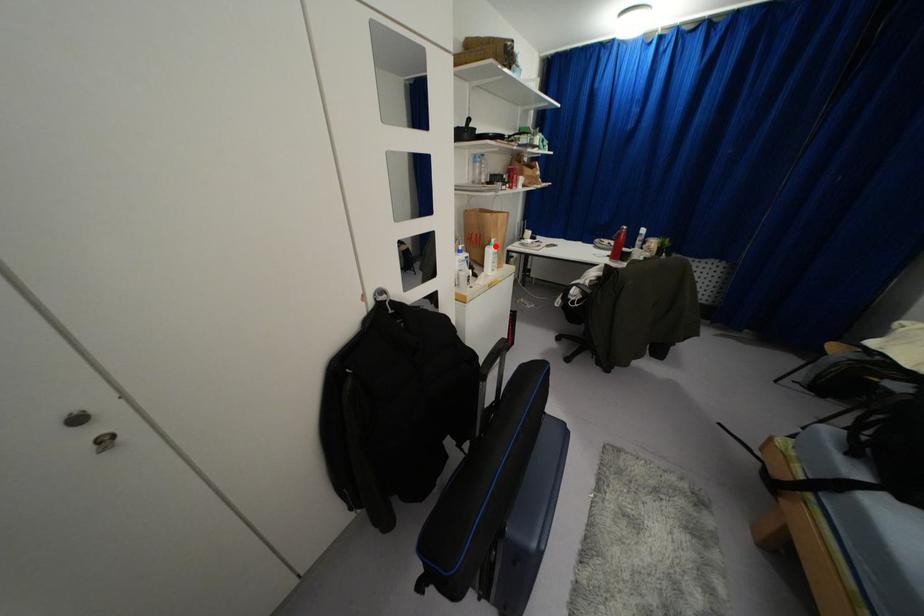
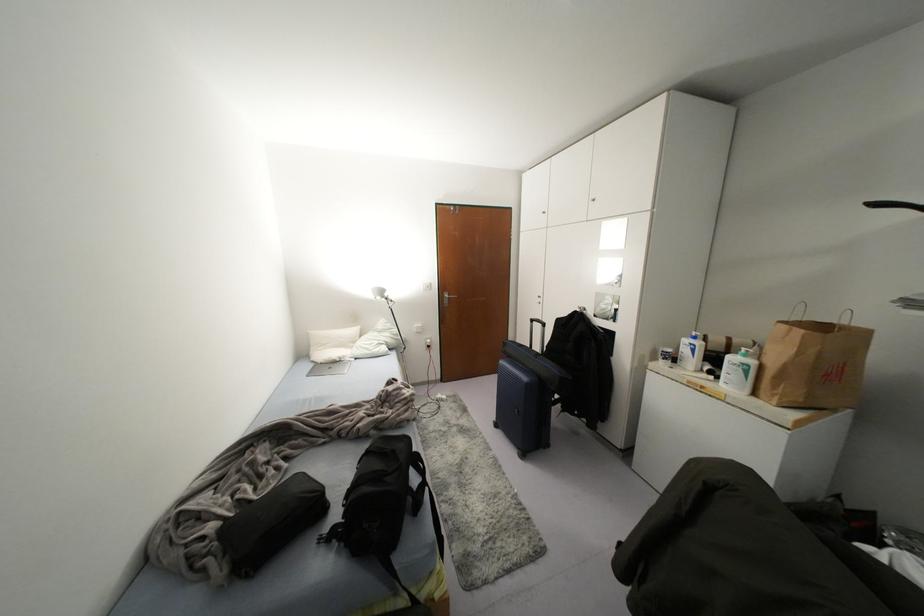
Locate, in the second image, the point that corresponds to the highlighted location in the first image.

(751, 362)